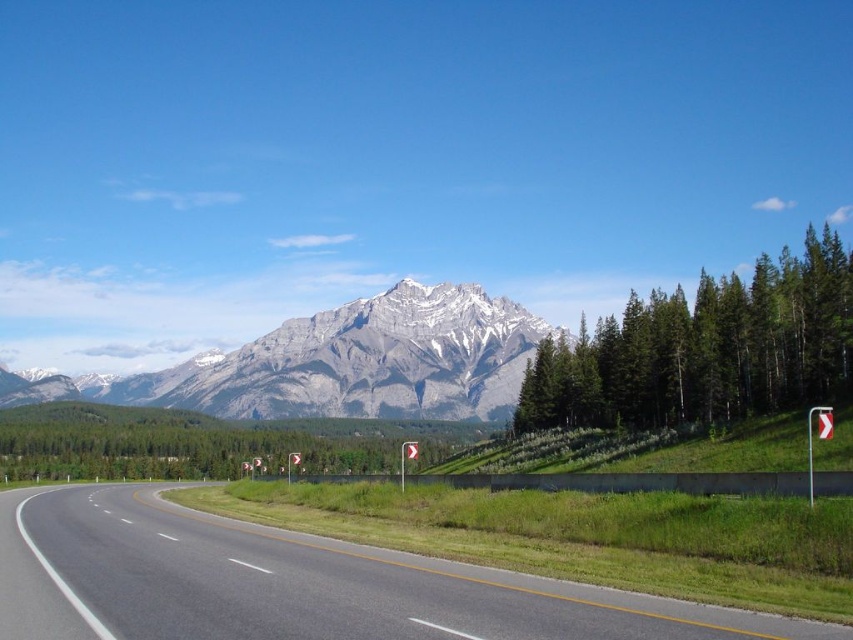
Question: Can you confirm if green grass at lower right is positioned below green textured tree at center?

Choices:
 (A) no
 (B) yes

Answer: (B)

Question: From the image, what is the correct spatial relationship of green textured tree at center in relation to green leafy trees at center?

Choices:
 (A) right
 (B) left

Answer: (A)

Question: Which object is farther from the camera taking this photo?

Choices:
 (A) green leafy trees at center
 (B) green grass at lower right
 (C) green textured tree at center
 (D) gray rocky mountain at center

Answer: (D)

Question: Which point appears closest to the camera in this image?

Choices:
 (A) (125, 604)
 (B) (170, 442)
 (C) (770, 376)
 (D) (421, 314)

Answer: (A)

Question: Where is green grass at lower right located in relation to green textured tree at center in the image?

Choices:
 (A) right
 (B) left

Answer: (B)

Question: Which point is closer to the camera?

Choices:
 (A) green leafy trees at center
 (B) green textured tree at center

Answer: (B)